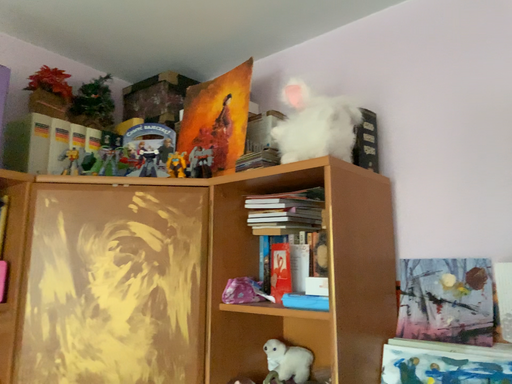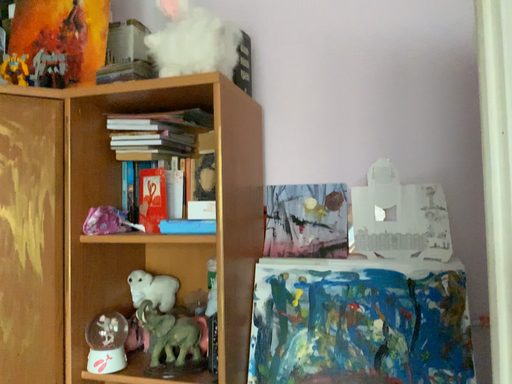
Question: How did the camera likely rotate when shooting the video?

Choices:
 (A) rotated left
 (B) rotated right

Answer: (B)